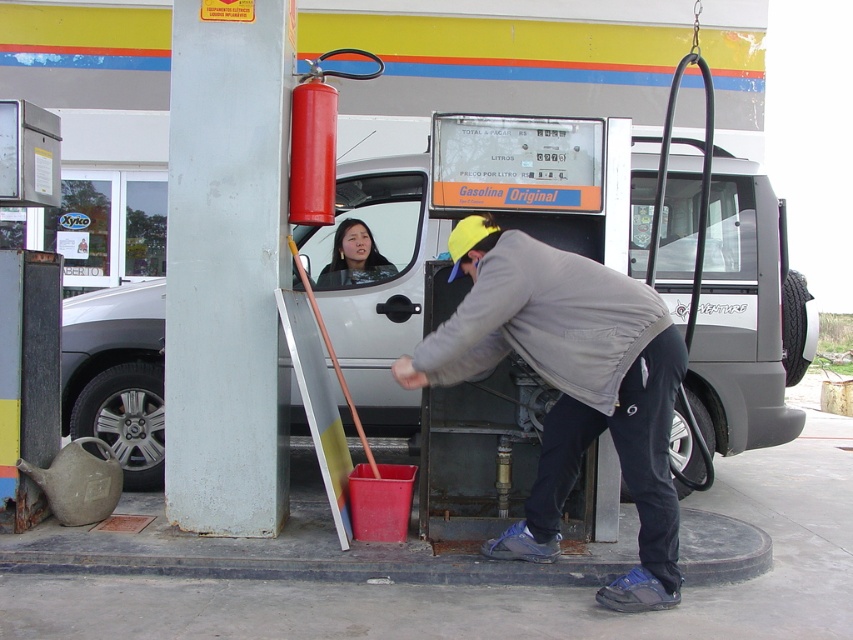
Which is behind, point (700, 296) or point (345, 243)?

Positioned behind is point (345, 243).

Is point (480, 417) positioned before point (376, 276)?

Yes.

This screenshot has height=640, width=853. What are the coordinates of `silver metallic van at center` in the screenshot? It's located at (746, 317).

Is point (329, 134) closer to camera compared to point (328, 264)?

Yes, it is.

Between red matte fire extinguisher at upper left and matte black jacket at center, which one appears on the right side from the viewer's perspective?

matte black jacket at center is more to the right.

Who is more distant from viewer, (311,154) or (343,221)?

Positioned behind is point (343,221).

The height and width of the screenshot is (640, 853). Find the location of `red matte fire extinguisher at upper left`. red matte fire extinguisher at upper left is located at coordinates pyautogui.click(x=316, y=140).

Can you confirm if silver metallic van at center is smaller than red matte fire extinguisher at upper left?

No, silver metallic van at center is not smaller than red matte fire extinguisher at upper left.

Between point (135, 397) and point (328, 106), which one is positioned in front?

Point (328, 106) is in front.

At what (x,y) coordinates should I click in order to perform the action: click on silver metallic van at center. Please return your answer as a coordinate pair (x, y). Image resolution: width=853 pixels, height=640 pixels. Looking at the image, I should click on (746, 317).